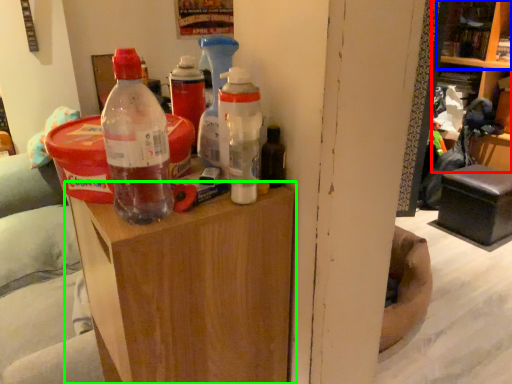
Question: Which is nearer to the shelf (highlighted by a red box)? shelf (highlighted by a blue box) or furniture (highlighted by a green box).

Choices:
 (A) shelf
 (B) furniture

Answer: (A)